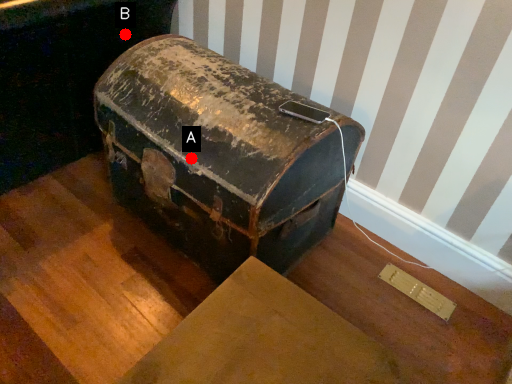
Question: Two points are circled on the image, labeled by A and B beside each circle. Which point is farther from the camera taking this photo?

Choices:
 (A) A is further
 (B) B is further

Answer: (B)